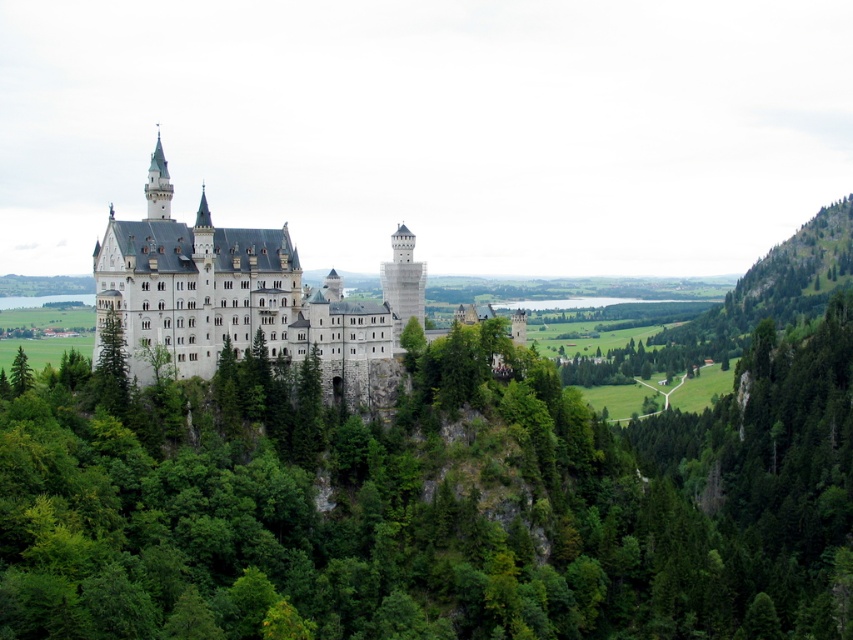
Question: From the image, what is the correct spatial relationship of white stone castle at center in relation to green leafy tree at left?

Choices:
 (A) left
 (B) right

Answer: (B)

Question: Does white stone castle at center come in front of green leafy tree at left?

Choices:
 (A) no
 (B) yes

Answer: (B)

Question: Does white stone castle at center appear under green leafy tree at left?

Choices:
 (A) yes
 (B) no

Answer: (B)

Question: Which point is closer to the camera?

Choices:
 (A) green leafy tree at left
 (B) white stone castle at center

Answer: (B)

Question: Which object is closer to the camera taking this photo?

Choices:
 (A) green leafy tree at left
 (B) white stone castle at center

Answer: (B)

Question: Which point appears farthest from the camera in this image?

Choices:
 (A) (10, 380)
 (B) (346, 332)

Answer: (B)